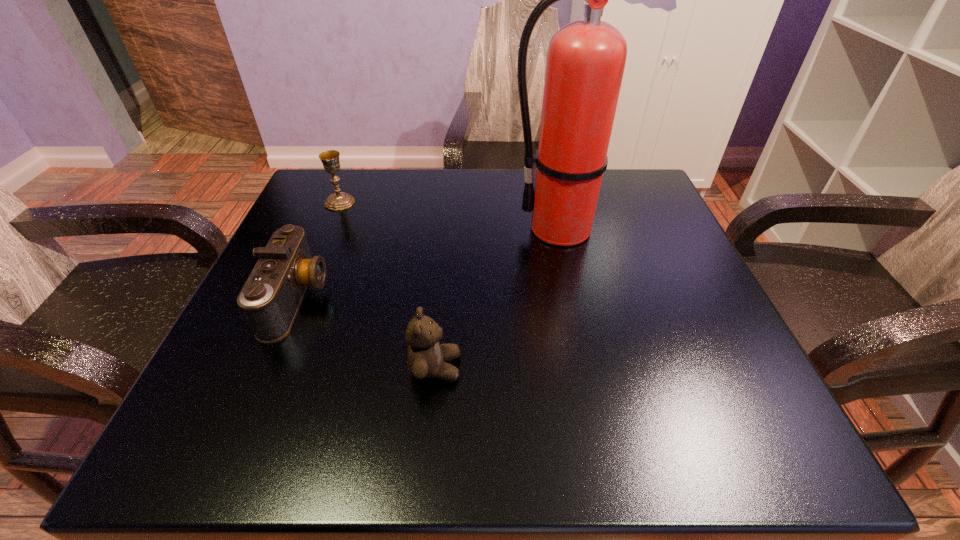
Identify the location of free point located 0.250m on the lens of the camera. The height and width of the screenshot is (540, 960). (463, 299).

You are a GUI agent. You are given a task and a screenshot of the screen. Output one action in this format:
    pyautogui.click(x=<x>, y=<y>)
    Task: Click on the fire extinguisher at the far edge
    This screenshot has width=960, height=540.
    Given the screenshot: What is the action you would take?
    pyautogui.click(x=586, y=59)

This screenshot has height=540, width=960. I want to click on chalice that is positioned at the far edge, so click(339, 200).

The image size is (960, 540). Find the location of `chalice at the left edge`. chalice at the left edge is located at coordinates (339, 200).

Find the location of a particular element. This screenshot has height=540, width=960. camera that is at the left edge is located at coordinates (271, 297).

Image resolution: width=960 pixels, height=540 pixels. I want to click on object that is at the right edge, so click(586, 59).

Find the location of `object that is at the far left corner`. object that is at the far left corner is located at coordinates (339, 200).

Identify the location of object positioned at the far right corner. (586, 59).

This screenshot has height=540, width=960. Identify the location of vacant space at the far edge of the desktop. (407, 169).

You are a GUI agent. You are given a task and a screenshot of the screen. Output one action in this format:
    pyautogui.click(x=<x>, y=<y>)
    Task: Click on the vacant point at the left edge
    Image resolution: width=960 pixels, height=540 pixels.
    Given the screenshot: What is the action you would take?
    pyautogui.click(x=361, y=225)